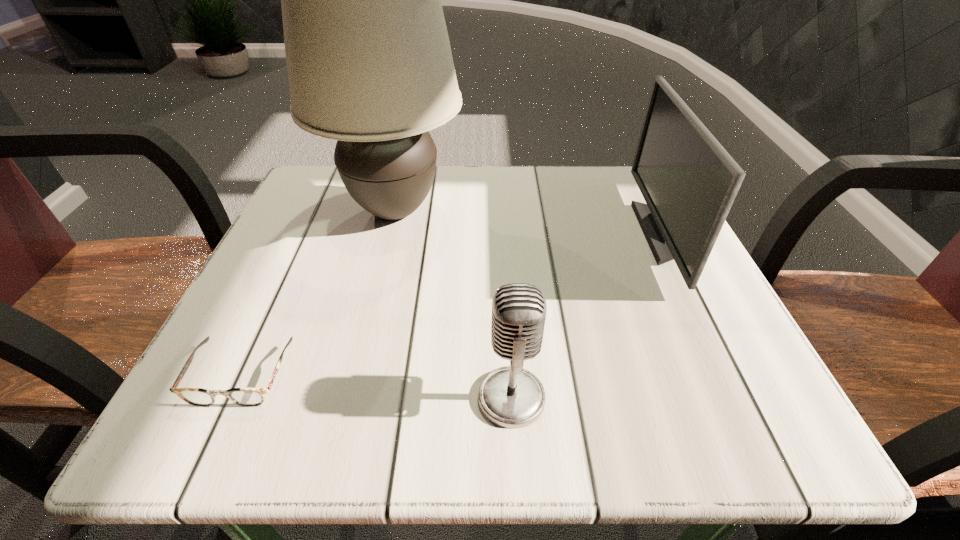
Find the location of a particular element. The height and width of the screenshot is (540, 960). vacant space that satisfies the following two spatial constraints: 1. on the screen side of the monitor; 2. on the frame of the shortest object is located at coordinates (732, 375).

Identify the location of blank area in the image that satisfies the following two spatial constraints: 1. on the frame of the shortest object; 2. on the right side of the second shortest object. (231, 397).

At what (x,y) coordinates should I click in order to perform the action: click on free space that satisfies the following two spatial constraints: 1. on the screen side of the monitor; 2. on the frame of the shortest object. Please return your answer as a coordinate pair (x, y). Looking at the image, I should click on (732, 375).